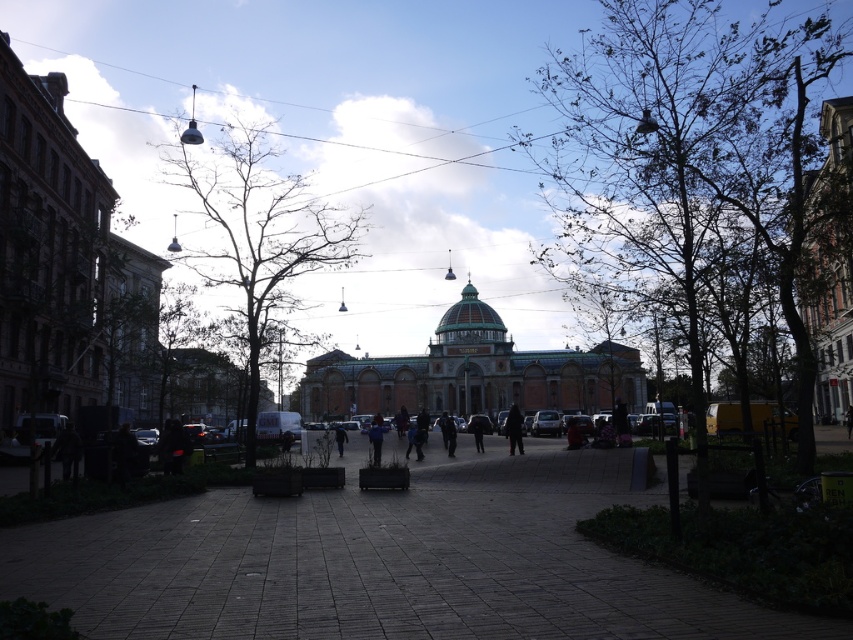
Question: Is dark blue jeans at center positioned behind dark blue jacket at center?

Choices:
 (A) yes
 (B) no

Answer: (B)

Question: Which object appears farthest from the camera in this image?

Choices:
 (A) green leafy tree at center
 (B) brick pavement at center
 (C) bare branches at left
 (D) dark blue jeans at center

Answer: (C)

Question: Which object appears farthest from the camera in this image?

Choices:
 (A) dark wool coat at center
 (B) dark blue jeans at center
 (C) brick pavement at center

Answer: (A)

Question: Does bare branches at left have a lesser width compared to dark blue jacket at center?

Choices:
 (A) no
 (B) yes

Answer: (A)

Question: Among these points, which one is farthest from the camera?

Choices:
 (A) (276, 220)
 (B) (395, 628)
 (C) (374, 422)

Answer: (C)

Question: Is brick pavement at center further to camera compared to dark wool coat at center?

Choices:
 (A) no
 (B) yes

Answer: (A)